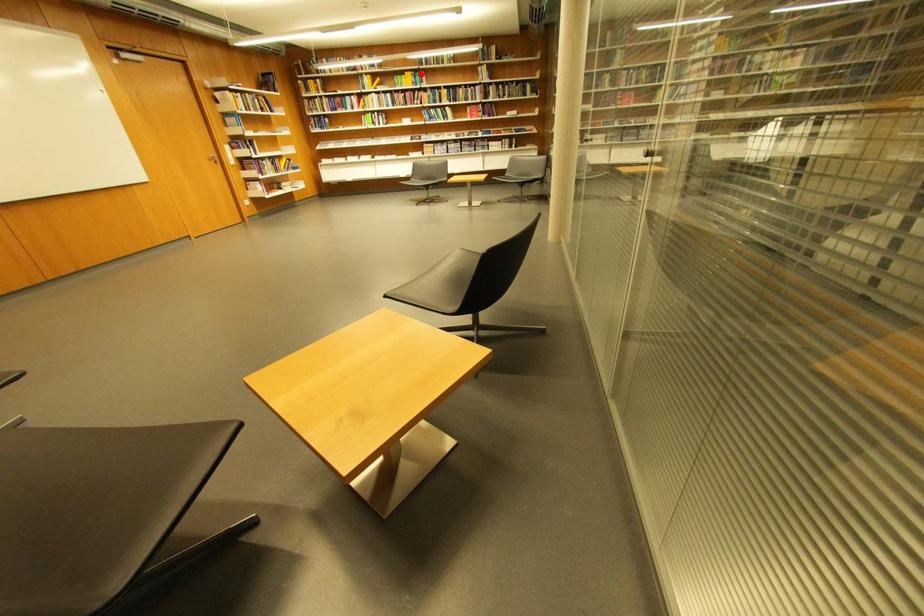
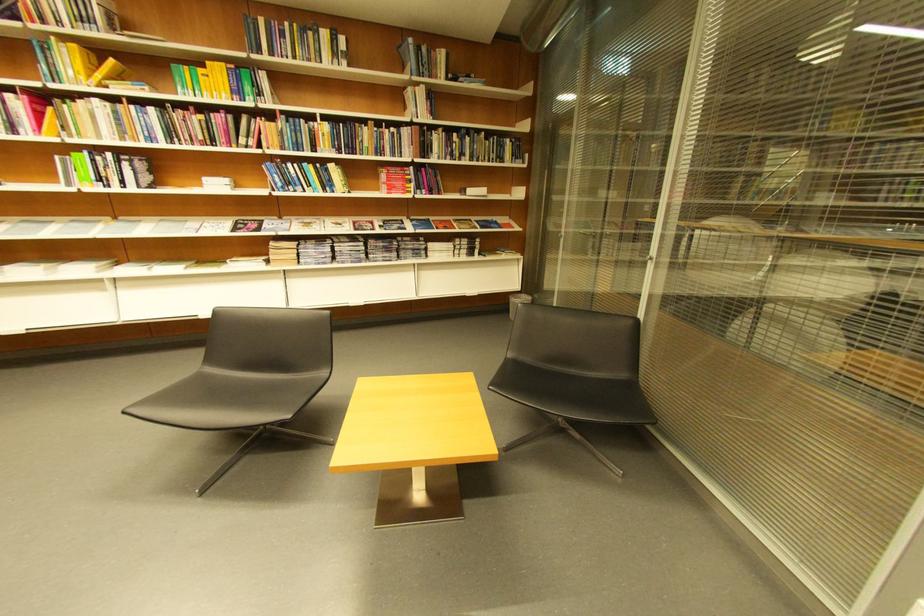
Find the pixel in the second image that matches the highlighted location in the first image.

(234, 66)